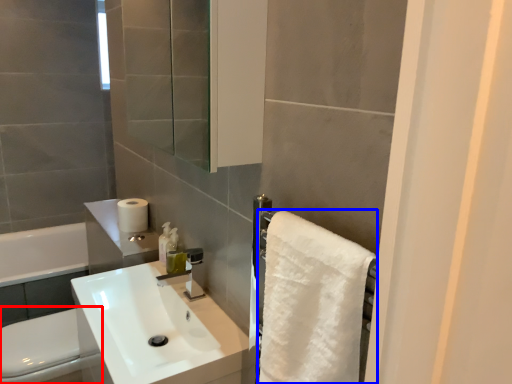
Question: Which point is further to the camera, toilet bowl (highlighted by a red box) or bath towel (highlighted by a blue box)?

Choices:
 (A) toilet bowl
 (B) bath towel

Answer: (A)